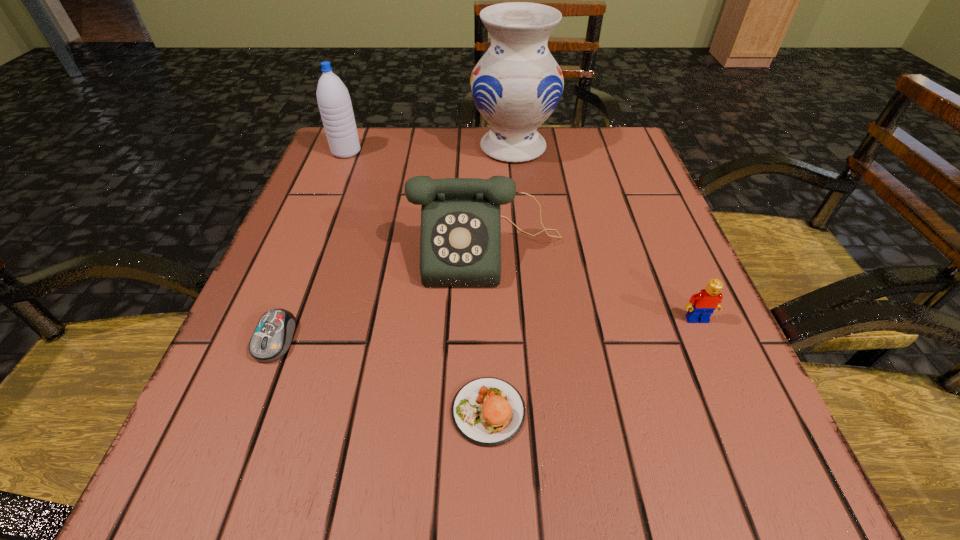
Where is `object that is at the far left corner`? object that is at the far left corner is located at coordinates (333, 98).

The height and width of the screenshot is (540, 960). I want to click on vacant area at the far edge of the desktop, so click(x=471, y=157).

Locate an element on the screen. free space at the left edge is located at coordinates (300, 217).

In the image, there is a desktop. What are the coordinates of `vacant space at the right edge` in the screenshot? It's located at (584, 182).

You are a GUI agent. You are given a task and a screenshot of the screen. Output one action in this format:
    pyautogui.click(x=<x>, y=<y>)
    Task: Click on the vacant area at the near left corner of the desktop
    The image size is (960, 540).
    Given the screenshot: What is the action you would take?
    pyautogui.click(x=271, y=489)

Locate an element on the screen. vacant area at the far right corner of the desktop is located at coordinates (615, 129).

Locate an element on the screen. This screenshot has height=540, width=960. free space at the near right corner is located at coordinates (736, 473).

The width and height of the screenshot is (960, 540). Find the location of `empty space that is in between the tallest object and the rightmost object`. empty space that is in between the tallest object and the rightmost object is located at coordinates (605, 233).

Identify the location of free point between the computer mouse and the tallest object. (395, 243).

You are a GUI agent. You are given a task and a screenshot of the screen. Output one action in this format:
    pyautogui.click(x=<x>, y=<y>)
    Task: Click on the vacant area that lies between the computer mouse and the vase
    
    Given the screenshot: What is the action you would take?
    395,243